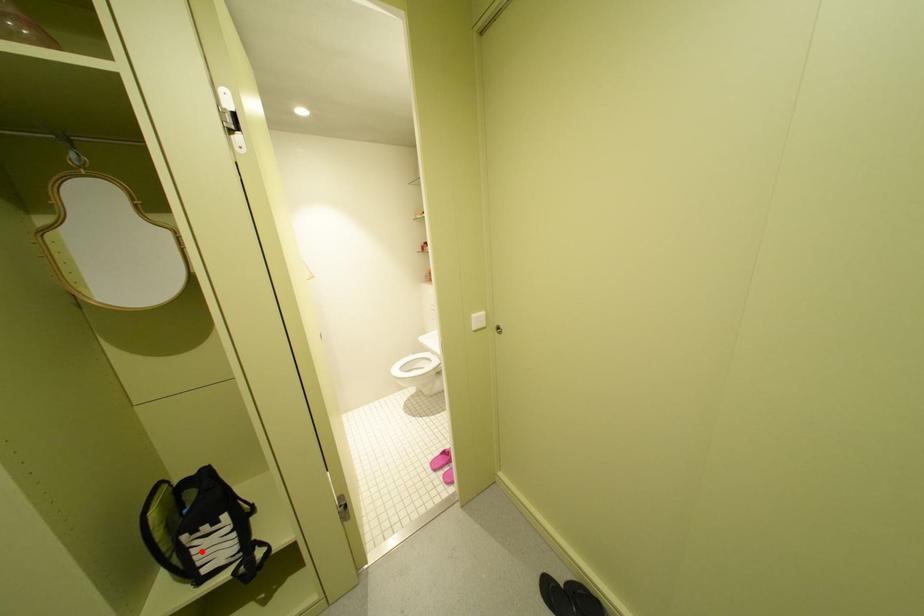
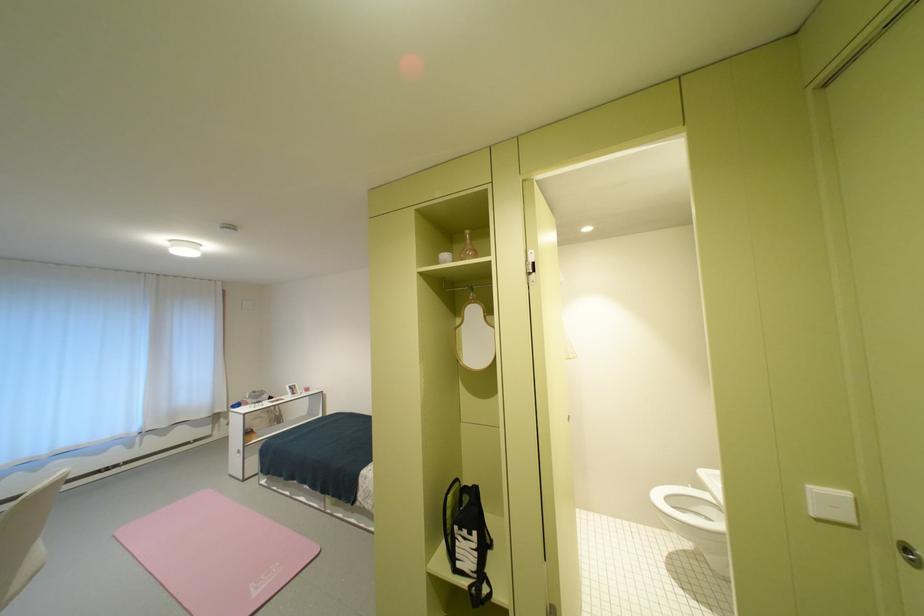
Where in the second image is the point corresponding to the highlighted location from the first image?

(467, 543)